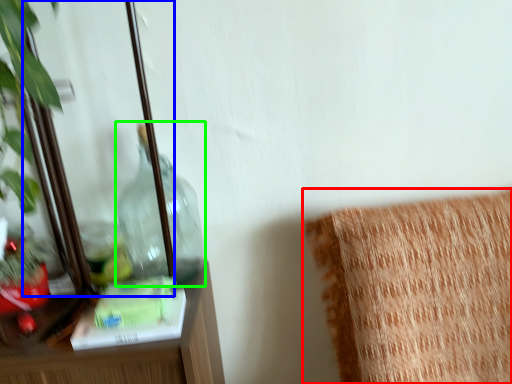
Question: Considering the real-world distances, which object is closest to furniture (highlighted by a red box)? mirror (highlighted by a blue box) or bottle (highlighted by a green box).

Choices:
 (A) mirror
 (B) bottle

Answer: (B)